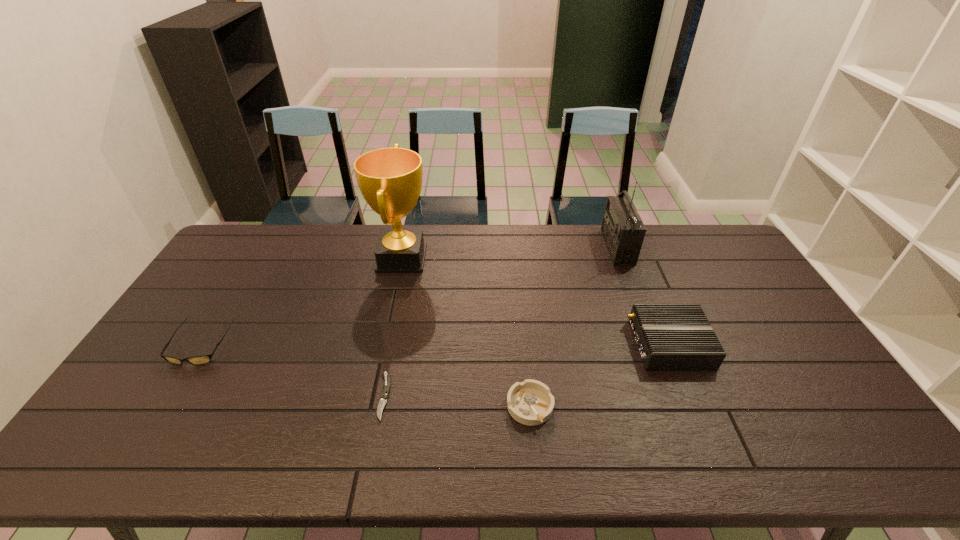
You are a GUI agent. You are given a task and a screenshot of the screen. Output one action in this format:
    pyautogui.click(x=<x>, y=<y>)
    Task: Click on the free space located on the front panel of the radio receiver
    
    Given the screenshot: What is the action you would take?
    pyautogui.click(x=514, y=247)

The image size is (960, 540). I want to click on vacant space located on the front panel of the radio receiver, so click(x=539, y=247).

The image size is (960, 540). What are the coordinates of `vacant area situated 0.350m on the back panel of the third tallest object` in the screenshot? It's located at (511, 345).

This screenshot has width=960, height=540. I want to click on vacant space located on the back panel of the third tallest object, so click(x=555, y=345).

The width and height of the screenshot is (960, 540). In order to click on vacant space located on the back panel of the third tallest object in this screenshot , I will do `click(528, 345)`.

Find the location of a particular element. This screenshot has height=540, width=960. free space located on the front-facing side of the leftmost object is located at coordinates (155, 421).

The image size is (960, 540). Identify the location of vacant space located on the right of the second shortest object. (690, 407).

You are a GUI agent. You are given a task and a screenshot of the screen. Output one action in this format:
    pyautogui.click(x=<x>, y=<y>)
    Task: Click on the free location located on the right of the shortest object
    Image resolution: width=960 pixels, height=540 pixels.
    Given the screenshot: What is the action you would take?
    pyautogui.click(x=500, y=396)

Find the location of `award located in the far edge section of the desktop`. award located in the far edge section of the desktop is located at coordinates (390, 179).

I want to click on radio receiver that is at the far edge, so click(x=623, y=230).